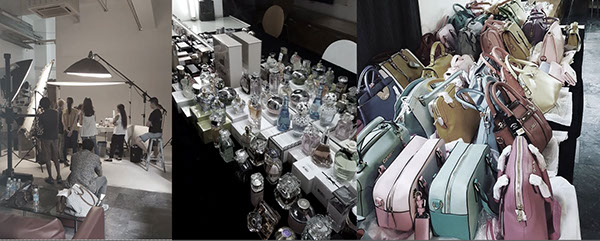
You are a GUI agent. You are given a task and a screenshot of the screen. Output one action in this format:
    pyautogui.click(x=<x>, y=<y>)
    Task: Click on the stool
    This screenshot has height=241, width=600.
    Given the screenshot: What is the action you would take?
    pyautogui.click(x=161, y=148)